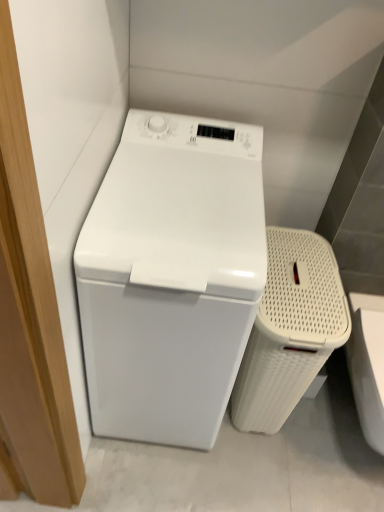
Find the location of a particular element. vacant space in front of white woven laundry basket at right is located at coordinates (257, 475).